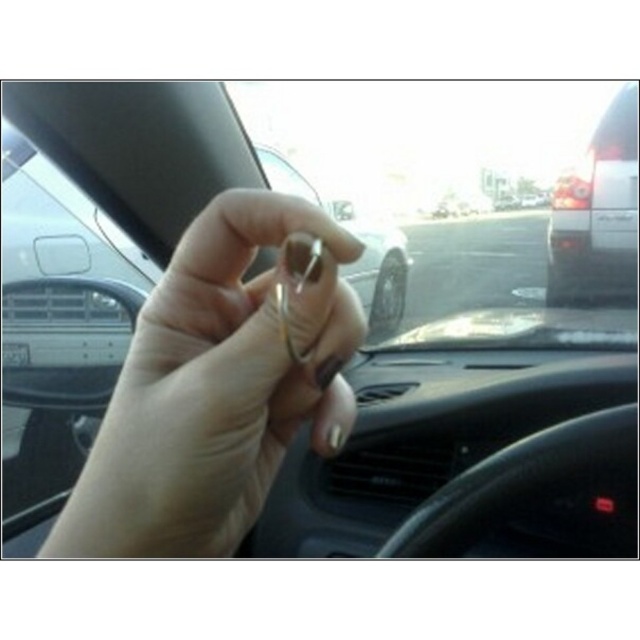
You are a driver who just got out of the car and noticed a gold metallic ring at center on the dashboard. Can you reach it from your current position without moving your seat?

The gold metallic ring at center is located at point (x=216, y=388), which is likely within reach if the driver can extend their arm without moving the seat.

You are a driver who just got out of the car and wants to put the gold metallic ring at center and the metallic silver key at center back into your pocket. Which one should you put first to ensure the key can fit properly?

The gold metallic ring at center is in front of the metallic silver key at center, so you should put the metallic silver key at center first to allow it to slide into the pocket without obstruction from the ring.

You are a driver who just got out of the white matte van at right and noticed a gold metallic ring at center on the dashboard. Can you reach the ring without moving your seat forward?

The gold metallic ring at center is not as tall as the white matte van at right, but since the van is outside the vehicle, the height comparison doesn